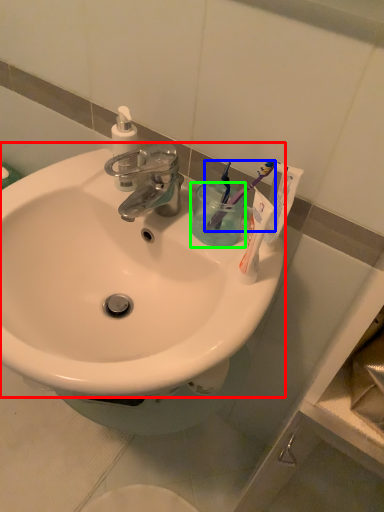
Question: Which is nearer to the sink (highlighted by a red box)? toothbrush (highlighted by a blue box) or liquid (highlighted by a green box).

Choices:
 (A) toothbrush
 (B) liquid

Answer: (B)